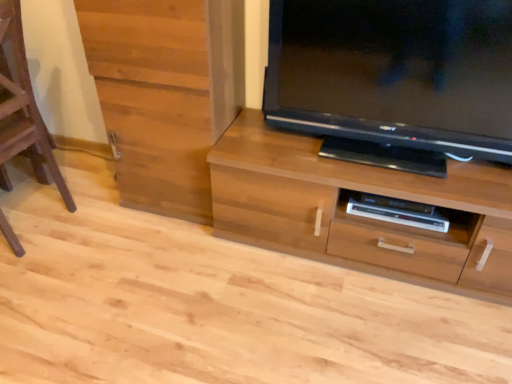
The width and height of the screenshot is (512, 384). What are the coordinates of `free point above satin wood shelf at lower center (from a real-world perspective)` in the screenshot? It's located at (399, 211).